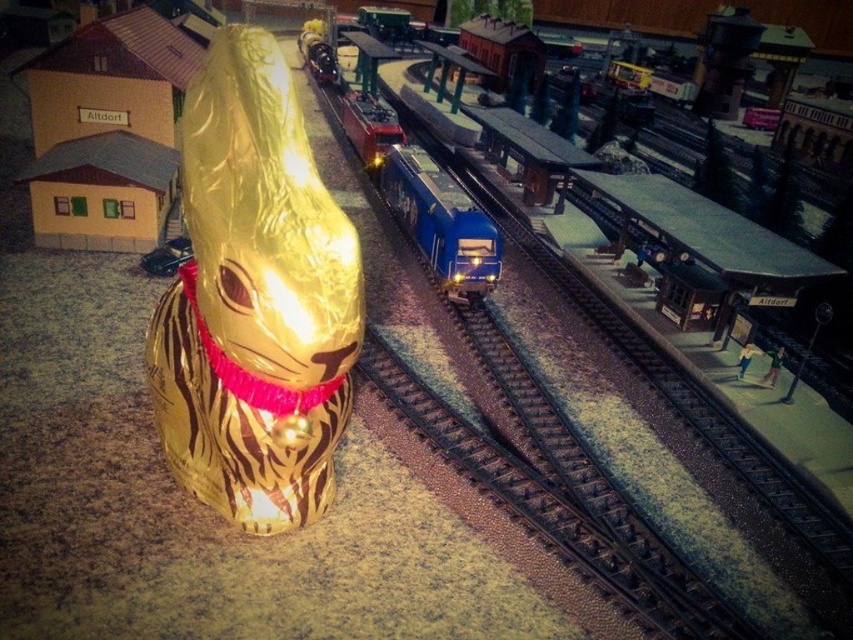
Does point (303, 406) come closer to viewer compared to point (383, 188)?

Yes, it is.

What do you see at coordinates (254, 300) in the screenshot? I see `gold foil bunny at left` at bounding box center [254, 300].

Does point (256, 260) lie in front of point (418, 168)?

That is True.

Image resolution: width=853 pixels, height=640 pixels. I want to click on gold foil bunny at left, so click(x=254, y=300).

Between gold foil bunny at left and metallic blue train tracks at center, which one is positioned higher?

metallic blue train tracks at center is above.

Locate an element on the screen. Image resolution: width=853 pixels, height=640 pixels. gold foil bunny at left is located at coordinates (254, 300).

Locate an element on the screen. gold foil bunny at left is located at coordinates (254, 300).

Between metallic blue train tracks at center and blue metallic train at center, which one has more height?

metallic blue train tracks at center

Is metallic blue train tracks at center positioned behind blue metallic train at center?

No, metallic blue train tracks at center is in front of blue metallic train at center.

At what (x,y) coordinates should I click in order to perform the action: click on metallic blue train tracks at center. Please return your answer as a coordinate pair (x, y). This screenshot has width=853, height=640. Looking at the image, I should click on (636, 438).

Where is `metallic blue train tracks at center`? This screenshot has height=640, width=853. metallic blue train tracks at center is located at coordinates pos(636,438).